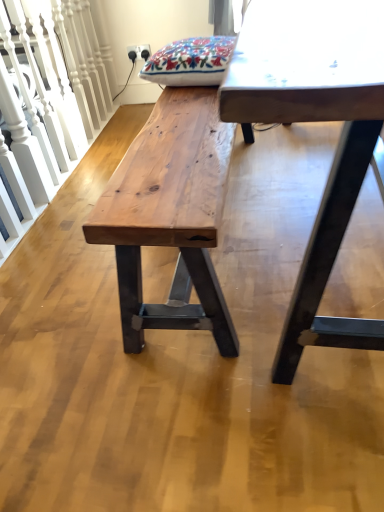
Where is `free location above natural wood bench at center (from a real-world perspective)`? This screenshot has width=384, height=512. free location above natural wood bench at center (from a real-world perspective) is located at coordinates (175, 132).